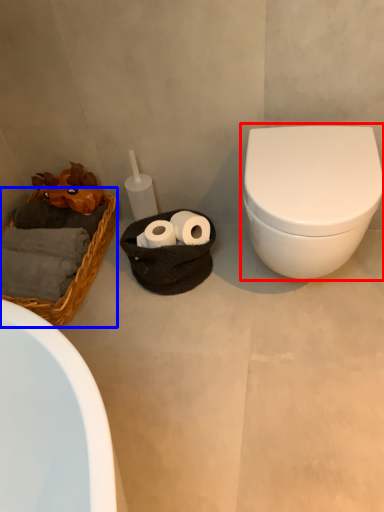
Question: Which of the following is the farthest to the observer, toilet (highlighted by a red box) or basket (highlighted by a blue box)?

Choices:
 (A) toilet
 (B) basket

Answer: (B)